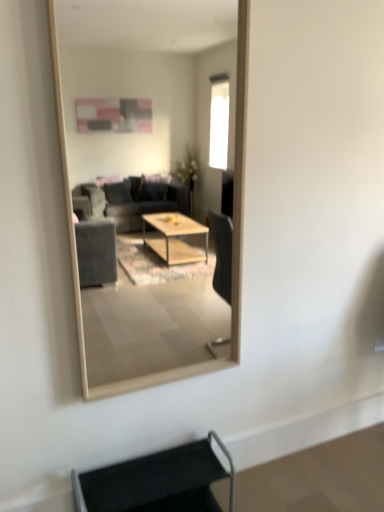
Identify the location of black fabric armchair at lower center. This screenshot has width=384, height=512. (157, 482).

This screenshot has height=512, width=384. Describe the element at coordinates (157, 482) in the screenshot. I see `black fabric armchair at lower center` at that location.

In order to click on wooden frame mirror at center in this screenshot , I will do coord(151,182).

What do you see at coordinates (151, 182) in the screenshot?
I see `wooden frame mirror at center` at bounding box center [151, 182].

This screenshot has height=512, width=384. What are the coordinates of `black fabric armchair at lower center` in the screenshot? It's located at (157, 482).

Can you confirm if black fabric armchair at lower center is positioned to the right of wooden frame mirror at center?

No.

Is black fabric armchair at lower center further to the viewer compared to wooden frame mirror at center?

Yes.

Does point (119, 492) come in front of point (216, 8)?

Yes, it is.

From the image's perspective, which object appears higher, black fabric armchair at lower center or wooden frame mirror at center?

wooden frame mirror at center.

From a real-world perspective, relative to wooden frame mirror at center, is black fabric armchair at lower center vertically above or below?

Clearly, from a real-world perspective, black fabric armchair at lower center is below wooden frame mirror at center.

Consider the image. Does black fabric armchair at lower center have a greater width compared to wooden frame mirror at center?

Yes.

Which of these two, black fabric armchair at lower center or wooden frame mirror at center, stands taller?

Standing taller between the two is wooden frame mirror at center.

Considering the relative sizes of black fabric armchair at lower center and wooden frame mirror at center in the image provided, is black fabric armchair at lower center smaller than wooden frame mirror at center?

Yes, black fabric armchair at lower center is smaller than wooden frame mirror at center.

Choose the correct answer: Is black fabric armchair at lower center inside wooden frame mirror at center or outside it?

black fabric armchair at lower center lies outside wooden frame mirror at center.

Is black fabric armchair at lower center far away from wooden frame mirror at center?

Indeed, black fabric armchair at lower center is not near wooden frame mirror at center.

Is black fabric armchair at lower center facing away from wooden frame mirror at center?

That's not correct — black fabric armchair at lower center is not looking away from wooden frame mirror at center.

Where is `armchair on the left of wooden frame mirror at center`? The height and width of the screenshot is (512, 384). armchair on the left of wooden frame mirror at center is located at coordinates (157, 482).

Is wooden frame mirror at center at the left side of black fabric armchair at lower center?

No.

Considering their positions, is wooden frame mirror at center located in front of or behind black fabric armchair at lower center?

In the image, wooden frame mirror at center appears in front of black fabric armchair at lower center.

Which is closer to the camera, (106, 312) or (94, 489)?

Point (106, 312) is positioned farther from the camera compared to point (94, 489).

From the image's perspective, would you say wooden frame mirror at center is positioned over black fabric armchair at lower center?

Indeed, from the image's perspective, wooden frame mirror at center is shown above black fabric armchair at lower center.

From a real-world perspective, between wooden frame mirror at center and black fabric armchair at lower center, who is vertically higher?

wooden frame mirror at center.

Considering the relative sizes of wooden frame mirror at center and black fabric armchair at lower center in the image provided, is wooden frame mirror at center thinner than black fabric armchair at lower center?

Indeed, wooden frame mirror at center has a lesser width compared to black fabric armchair at lower center.

In terms of height, does wooden frame mirror at center look taller or shorter compared to black fabric armchair at lower center?

Considering their sizes, wooden frame mirror at center has more height than black fabric armchair at lower center.

Between wooden frame mirror at center and black fabric armchair at lower center, which one has larger size?

wooden frame mirror at center is bigger.

Is black fabric armchair at lower center located within wooden frame mirror at center?

That's incorrect, black fabric armchair at lower center is not inside wooden frame mirror at center.

Would you consider wooden frame mirror at center to be distant from black fabric armchair at lower center?

wooden frame mirror at center is positioned a significant distance from black fabric armchair at lower center.

Is wooden frame mirror at center facing away from black fabric armchair at lower center?

wooden frame mirror at center is not turned away from black fabric armchair at lower center.

What's the angular difference between wooden frame mirror at center and black fabric armchair at lower center's facing directions?

There is a 0.00268-degree angle between the facing directions of wooden frame mirror at center and black fabric armchair at lower center.

Locate an element on the screen. mirror in front of the black fabric armchair at lower center is located at coordinates (151, 182).

Image resolution: width=384 pixels, height=512 pixels. Identify the location of armchair located underneath the wooden frame mirror at center (from a real-world perspective). (157, 482).

The image size is (384, 512). I want to click on mirror located in front of the black fabric armchair at lower center, so click(151, 182).